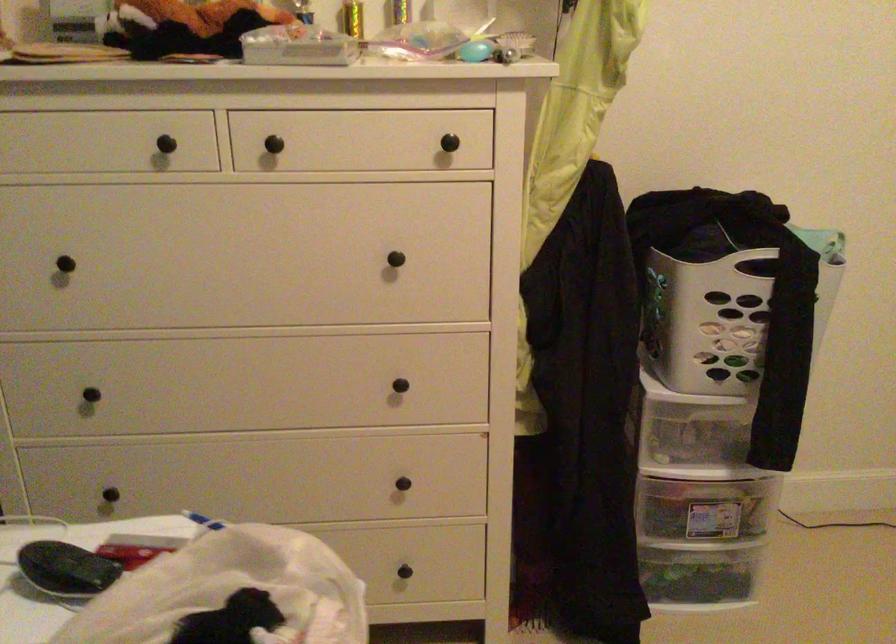
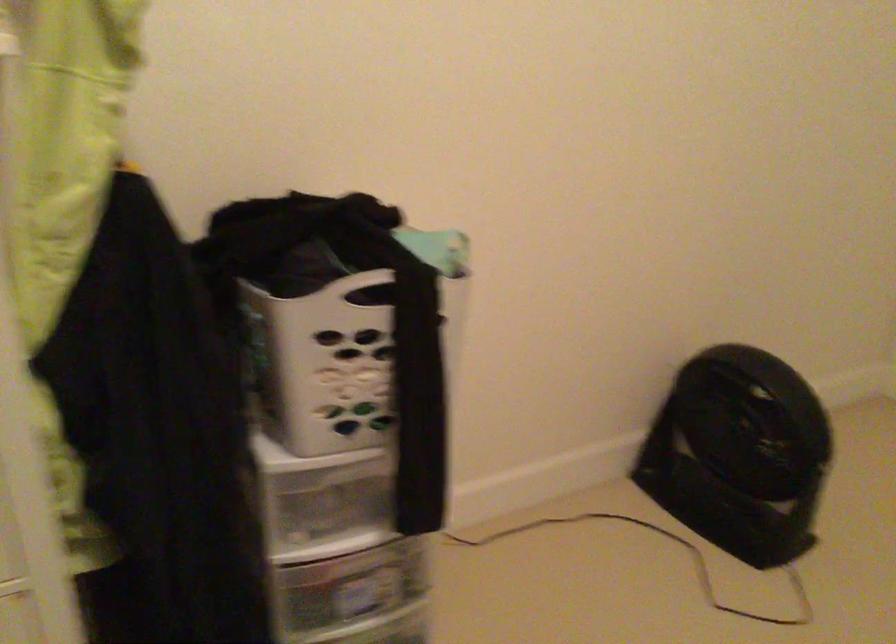
Question: The camera is either moving clockwise (left) or counter-clockwise (right) around the object. The first image is from the beginning of the video and the second image is from the end. Is the camera moving left or right when shooting the video?

Choices:
 (A) Left
 (B) Right

Answer: (A)